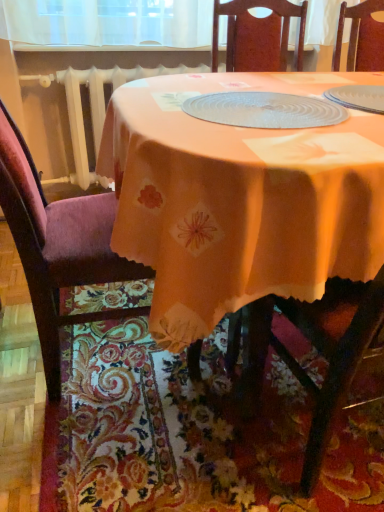
Question: Based on their positions, is orange fabric table at center located to the left or right of velvet purple chair at left?

Choices:
 (A) right
 (B) left

Answer: (A)

Question: Which is correct: orange fabric table at center is inside velvet purple chair at left, or outside of it?

Choices:
 (A) inside
 (B) outside

Answer: (B)

Question: Based on their relative distances, which object is nearer to the orange fabric placemat at lower center?

Choices:
 (A) velvet purple chair at left
 (B) orange fabric table at center
 (C) clear plastic placemat at center

Answer: (A)

Question: Which object is positioned closest to the clear plastic placemat at center?

Choices:
 (A) velvet purple chair at left
 (B) orange fabric placemat at lower center
 (C) orange fabric table at center

Answer: (C)